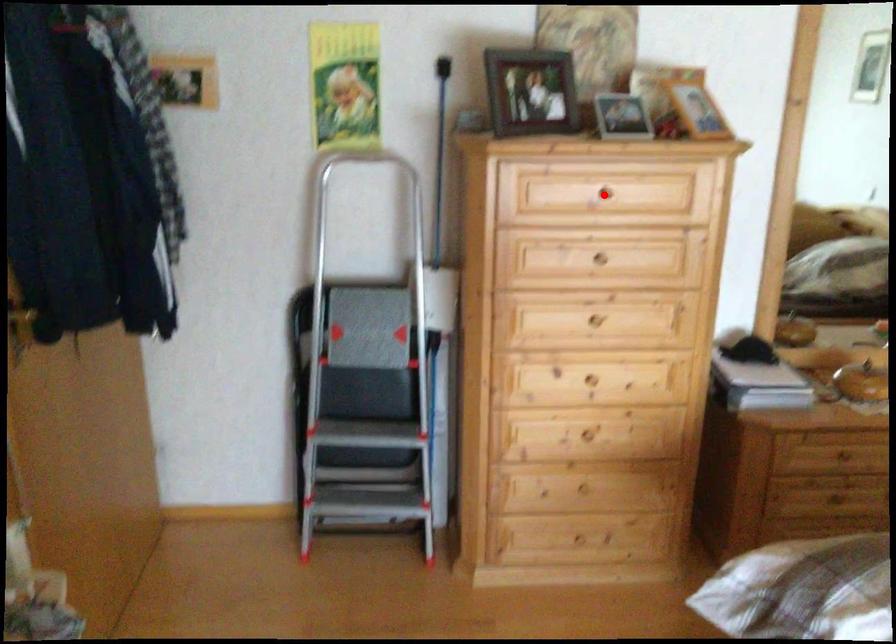
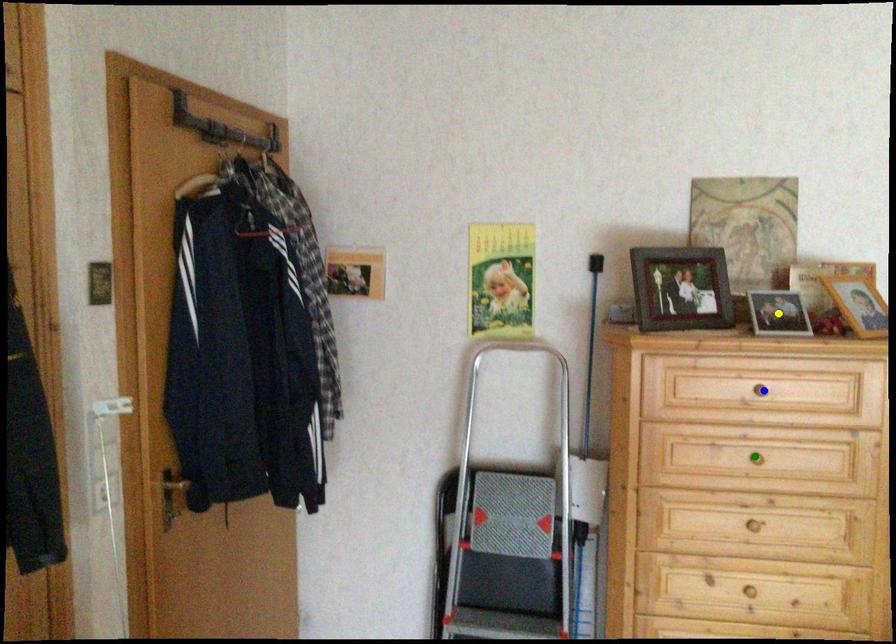
Question: I am providing you with two images of the same scene from different viewpoints. A red point is marked on the first image. You are given multiple points on the second image. Which point in image 2 represents the same 3d spot as the red point in image 1?

Choices:
 (A) yellow point
 (B) blue point
 (C) green point

Answer: (B)